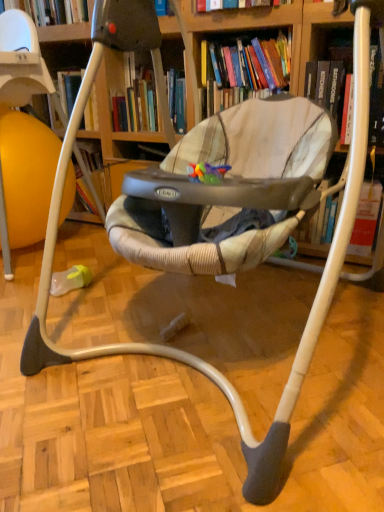
Question: Can you confirm if wooden bookcase at center is taller than hardcover book at upper center, the second book in the right-to-left sequence?

Choices:
 (A) yes
 (B) no

Answer: (A)

Question: Is wooden bookcase at center positioned in front of hardcover book at upper center, the second book in the right-to-left sequence?

Choices:
 (A) yes
 (B) no

Answer: (A)

Question: Is hardcover book at upper center, the second book in the right-to-left sequence, completely or partially inside wooden bookcase at center?

Choices:
 (A) no
 (B) yes

Answer: (A)

Question: Is wooden bookcase at center wider than hardcover book at upper center, the first book viewed from the left?

Choices:
 (A) no
 (B) yes

Answer: (B)

Question: Are wooden bookcase at center and hardcover book at upper center, the first book viewed from the left, far apart?

Choices:
 (A) no
 (B) yes

Answer: (A)

Question: Considering the relative sizes of wooden bookcase at center and hardcover book at upper center, the first book viewed from the left, in the image provided, is wooden bookcase at center smaller than hardcover book at upper center, the first book viewed from the left,?

Choices:
 (A) yes
 (B) no

Answer: (B)

Question: Is wooden bookcase at center directly adjacent to hardcover book at upper right, which appears as the 2th book when viewed from the left?

Choices:
 (A) yes
 (B) no

Answer: (B)

Question: Does wooden bookcase at center appear on the right side of hardcover book at upper right, which appears as the 2th book when viewed from the left?

Choices:
 (A) no
 (B) yes

Answer: (A)

Question: Is wooden bookcase at center completely or partially outside of hardcover book at upper right, which appears as the 2th book when viewed from the left?

Choices:
 (A) yes
 (B) no

Answer: (A)

Question: Is wooden bookcase at center shorter than hardcover book at upper right, which appears as the 2th book when viewed from the left?

Choices:
 (A) no
 (B) yes

Answer: (A)

Question: Considering the relative sizes of wooden bookcase at center and hardcover book at upper right, which appears as the 2th book when viewed from the left, in the image provided, is wooden bookcase at center bigger than hardcover book at upper right, which appears as the 2th book when viewed from the left,?

Choices:
 (A) no
 (B) yes

Answer: (B)

Question: Is wooden bookcase at center at the left side of hardcover book at upper right, which appears as the 2th book when viewed from the left?

Choices:
 (A) no
 (B) yes

Answer: (B)

Question: Does hardcover book at upper center, the second book in the right-to-left sequence, lie behind hardcover book at upper right, which appears as the 2th book when viewed from the left?

Choices:
 (A) yes
 (B) no

Answer: (A)